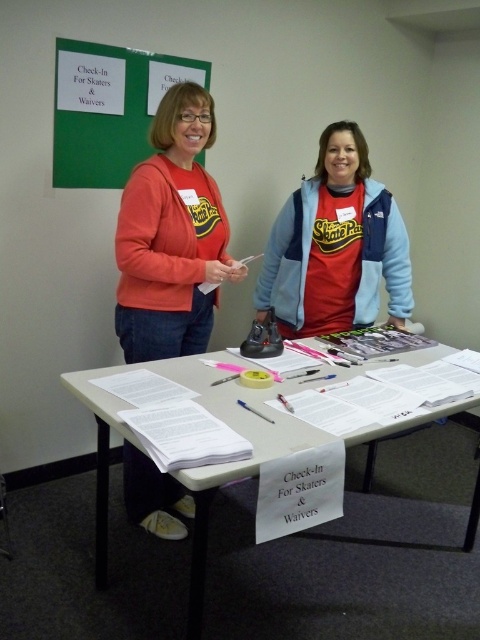
What is located at the coordinates point (228, 464) in the image?

The point (228, 464) indicates a white paper at center.

You are taking a photo of the check in table and need to focus on both the point at (113, 51) and the point at (279, 237). Which point will be in focus first if you adjust your camera focus from near to far?

Point at (113, 51) will be in focus first because it is closer to the camera than point at (279, 237).

You are an event volunteer trying to identify which volunteer has a larger clothing item. You see the matte orange sweater at left and the matte red sweatshirt at center. Which volunteer should you approach if you need to borrow a larger size?

You should approach the volunteer wearing the matte orange sweater at left because it is bigger than the matte red sweatshirt at center.